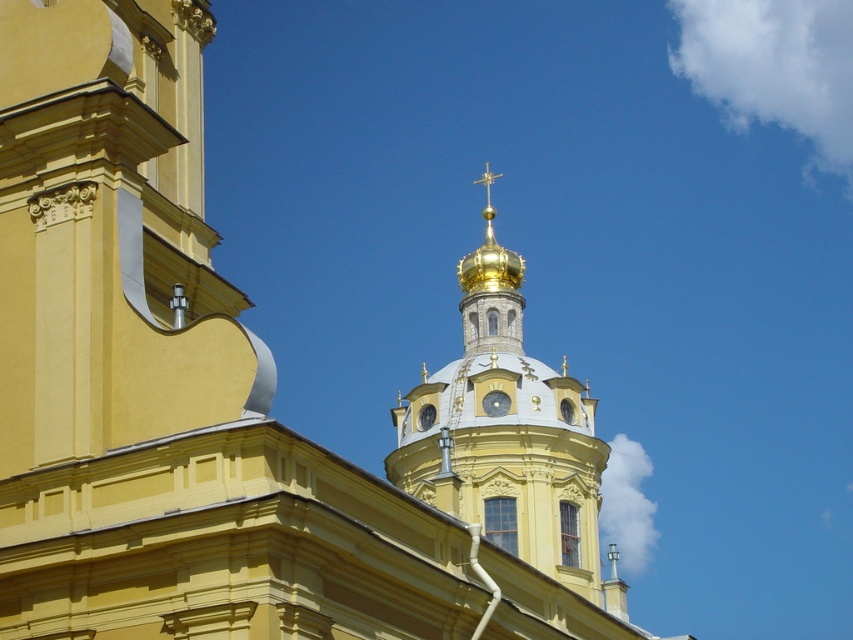
Question: Where is gold plated dome at center located in relation to silver metallic clock at center in the image?

Choices:
 (A) right
 (B) left

Answer: (B)

Question: Can you confirm if gold plated dome at center is smaller than silver metallic clock at center?

Choices:
 (A) no
 (B) yes

Answer: (A)

Question: Does gold plated dome at center appear on the left side of silver metallic clock at center?

Choices:
 (A) yes
 (B) no

Answer: (A)

Question: Which of the following is the farthest from the observer?

Choices:
 (A) (579, 564)
 (B) (489, 394)

Answer: (B)

Question: Among these objects, which one is nearest to the camera?

Choices:
 (A) silver metallic clock at center
 (B) gold plated dome at center

Answer: (B)

Question: Which object is farther from the camera taking this photo?

Choices:
 (A) gold plated dome at center
 (B) silver metallic clock at center

Answer: (B)